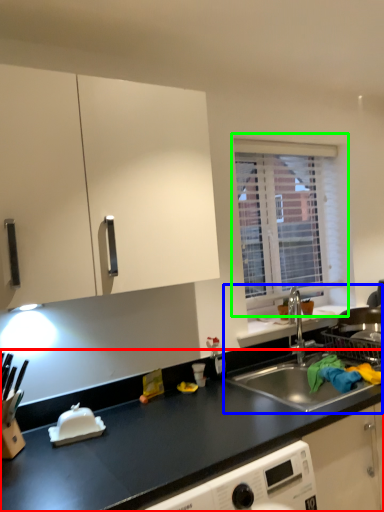
Question: Which is nearer to the countertop (highlighted by a red box)? sink (highlighted by a blue box) or window (highlighted by a green box).

Choices:
 (A) sink
 (B) window

Answer: (A)